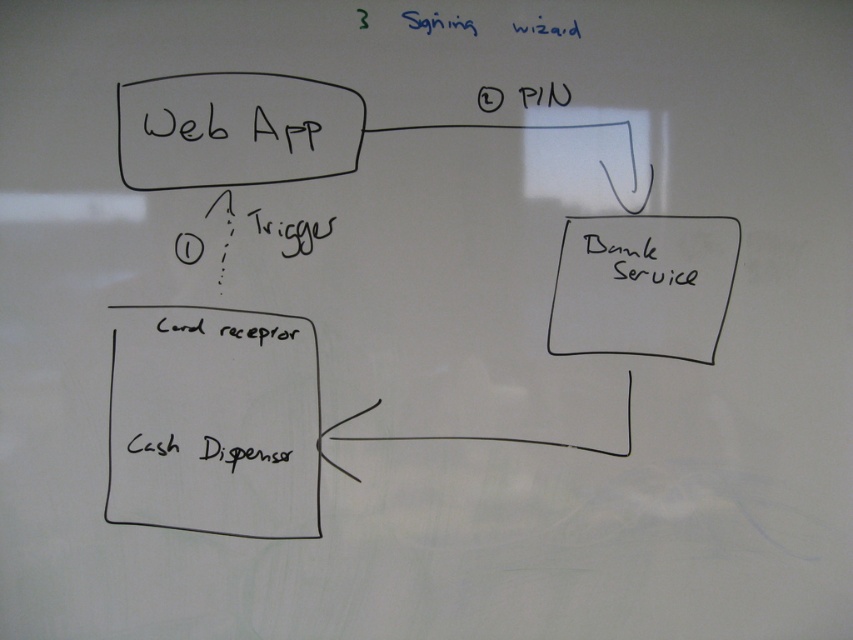
Question: Does black paper at upper right appear over black handwritten text at center right?

Choices:
 (A) no
 (B) yes

Answer: (A)

Question: Does black paper at upper right have a greater width compared to black handwritten text at center right?

Choices:
 (A) no
 (B) yes

Answer: (B)

Question: Can you confirm if black paper at upper right is positioned to the left of black handwritten text at center right?

Choices:
 (A) yes
 (B) no

Answer: (B)

Question: Which object appears closest to the camera in this image?

Choices:
 (A) black paper at upper right
 (B) black handwritten text at center right

Answer: (A)